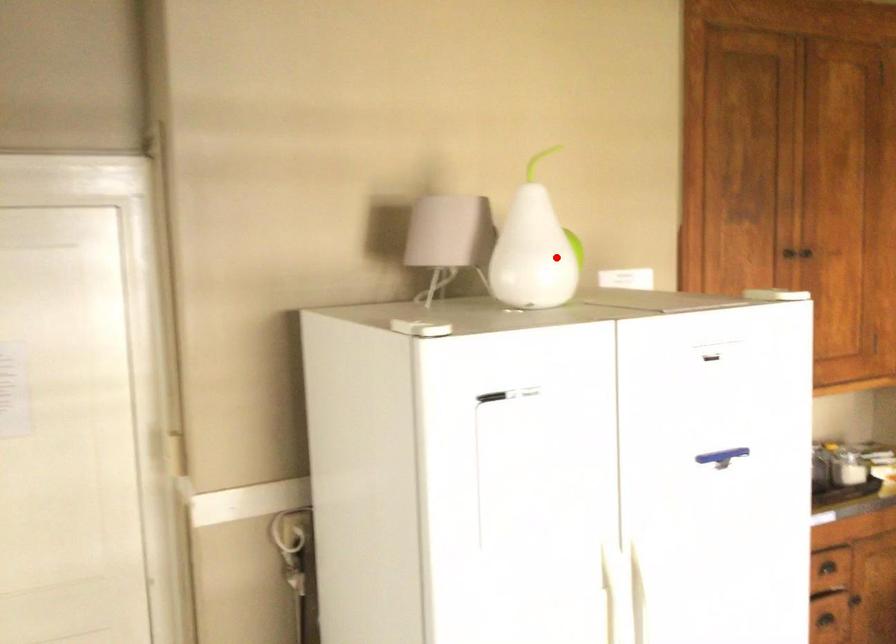
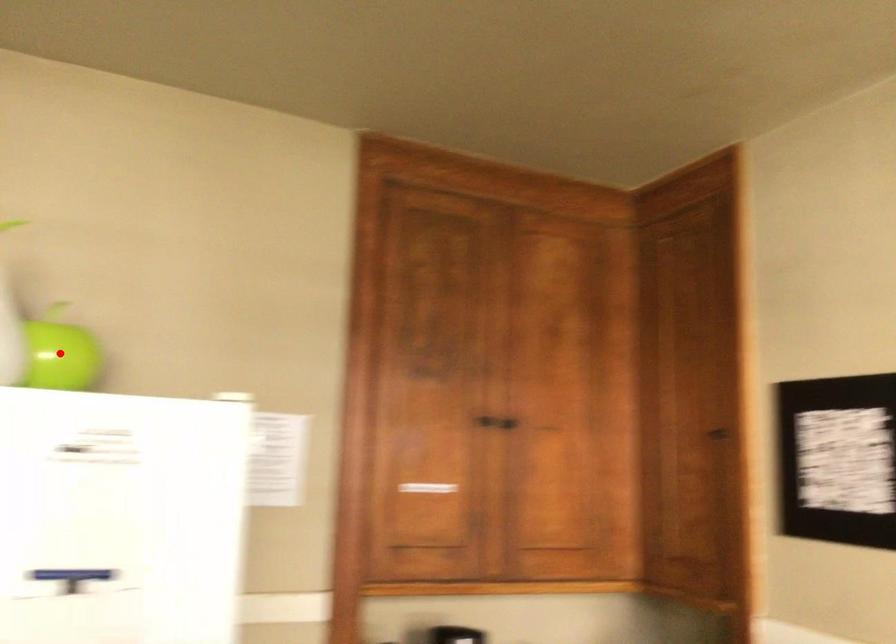
I am providing you with two images of the same scene from different viewpoints. A red point is marked on the first image and another point is marked on the second image. Is the marked point in image1 the same physical position as the marked point in image2?

Yes